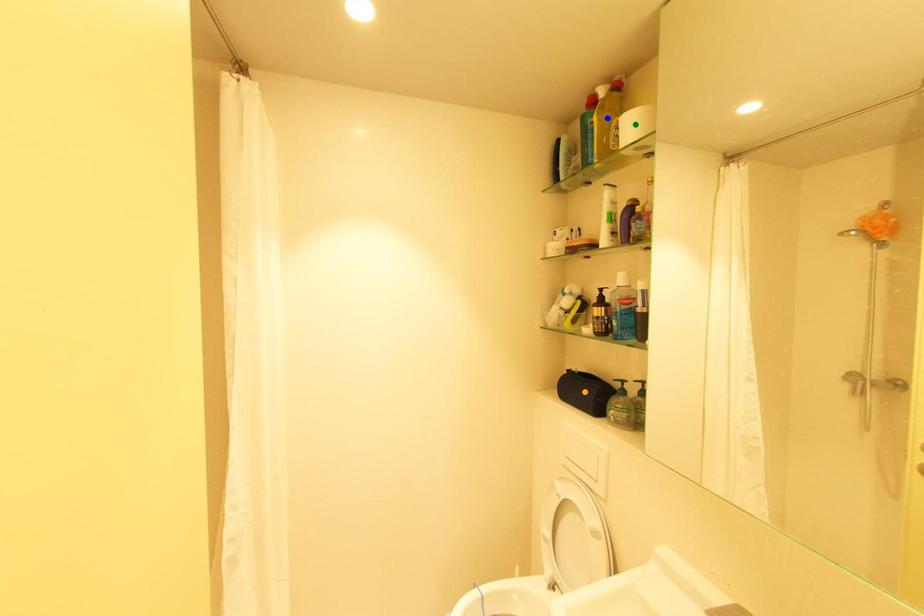
Order these from nearest to farthest:
- blue point
- orange point
- green point

green point → blue point → orange point